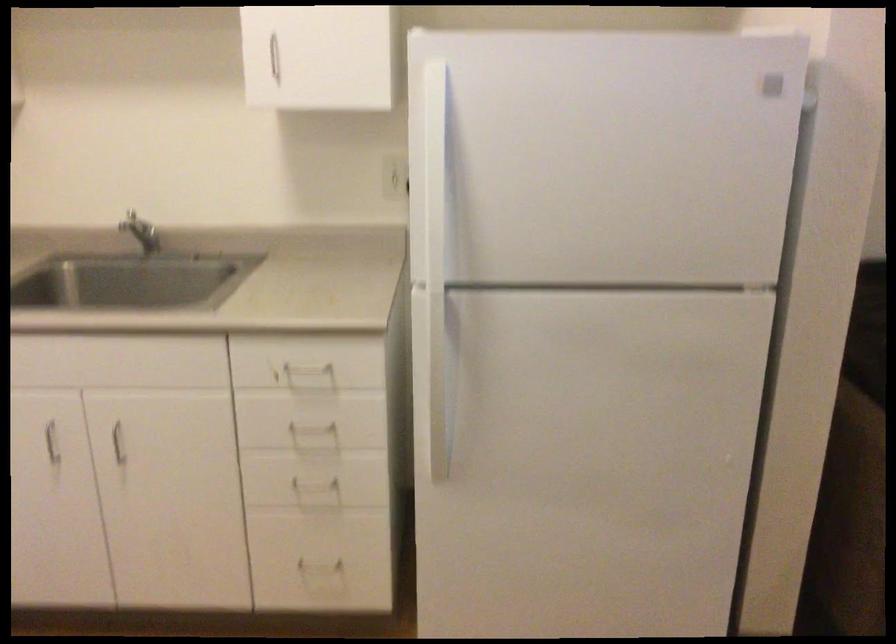
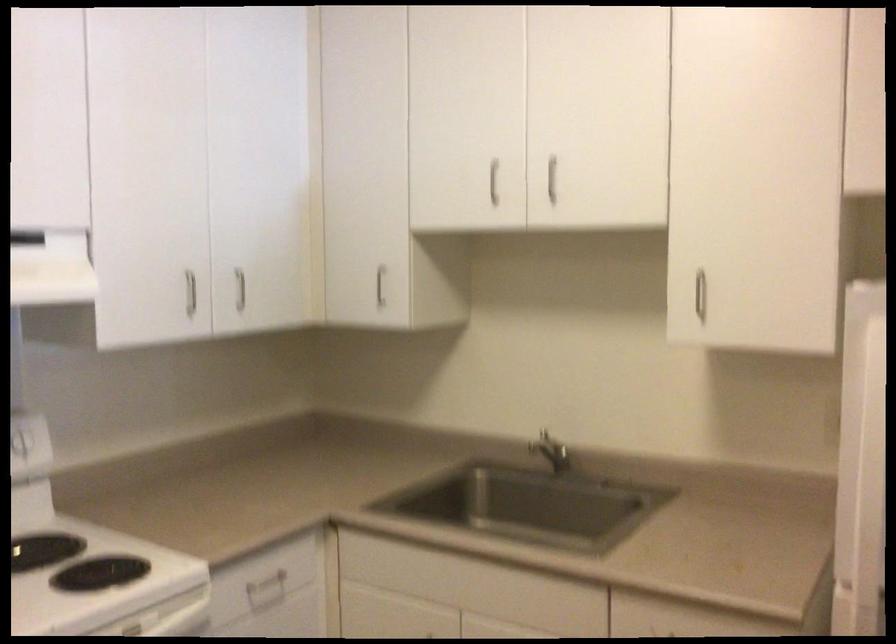
Question: Based on the continuous images, in which direction is the camera rotating? Reply with the corresponding letter.

Choices:
 (A) Left
 (B) Right
 (C) Up
 (D) Down

Answer: (A)